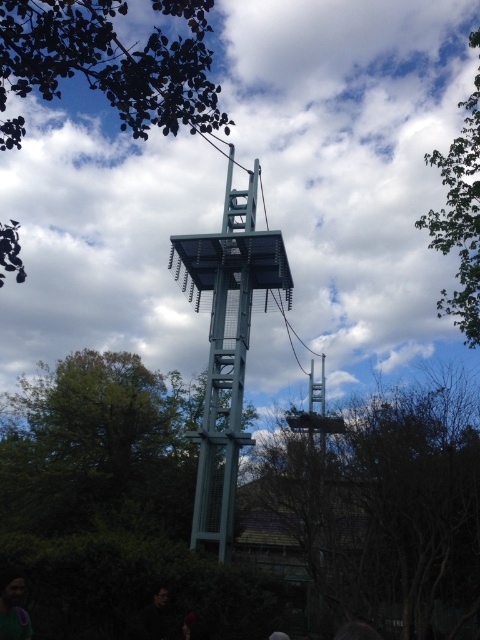
Question: Which object appears farthest from the camera in this image?

Choices:
 (A) metallic gray bell tower at center
 (B) brown leafy tree at center
 (C) green leafy tree at upper right
 (D) purple fabric at lower left

Answer: (C)

Question: Does dark green leaves at upper center have a larger size compared to purple fabric at lower left?

Choices:
 (A) no
 (B) yes

Answer: (B)

Question: Which point appears farthest from the camera in this image?

Choices:
 (A) (0, 634)
 (B) (394, 596)
 (C) (477, 252)
 (D) (207, 428)

Answer: (C)

Question: Is brown leafy tree at center to the right of green leafy tree at upper right from the viewer's perspective?

Choices:
 (A) no
 (B) yes

Answer: (A)

Question: Which point is farther from the camera taking this photo?

Choices:
 (A) (144, 612)
 (B) (468, 227)
 (C) (4, 128)

Answer: (B)

Question: Can you confirm if purple fabric at lower left is bigger than dark matte jacket at lower center?

Choices:
 (A) no
 (B) yes

Answer: (A)